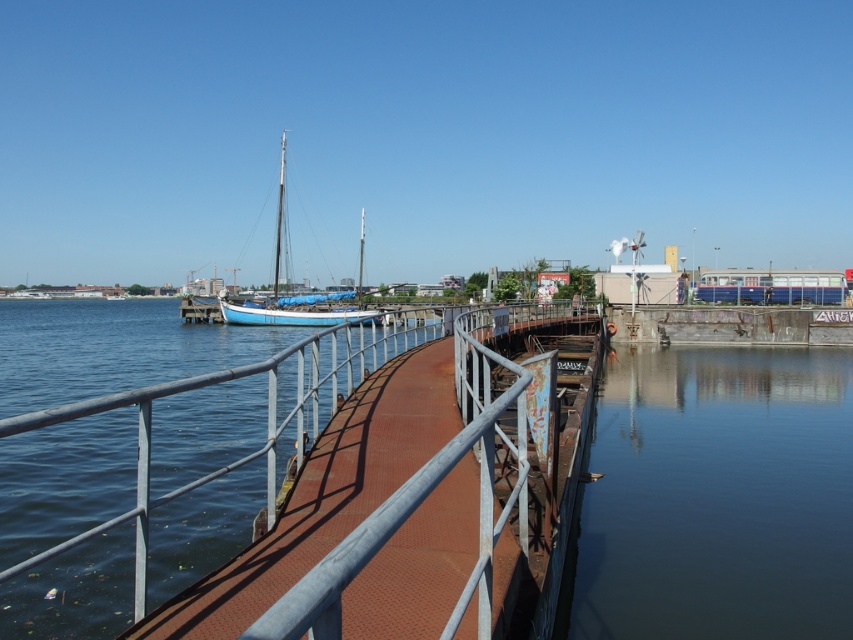
You are standing on the curved pedestrian bridge and want to compare the height of the rusty metal rail at center and the blue matte sailboat at center. Which one is taller?

The blue matte sailboat at center is taller than the rusty metal rail at center.

You are a painter standing on the wooden pier near the blue matte sailboat at center. You want to paint the rusty metal rail at center but need to know if you can fit your 2.5 meter wide canvas between them. Can you do it?

The rusty metal rail at center has a width larger than the blue matte sailboat at center. Since the canvas is 2.5 meters wide, you need to check the distance between the two objects. However, the description only states the rail is wider than the boat, not the space between them. Without knowing the exact distance, it is uncertain if the canvas will fit.